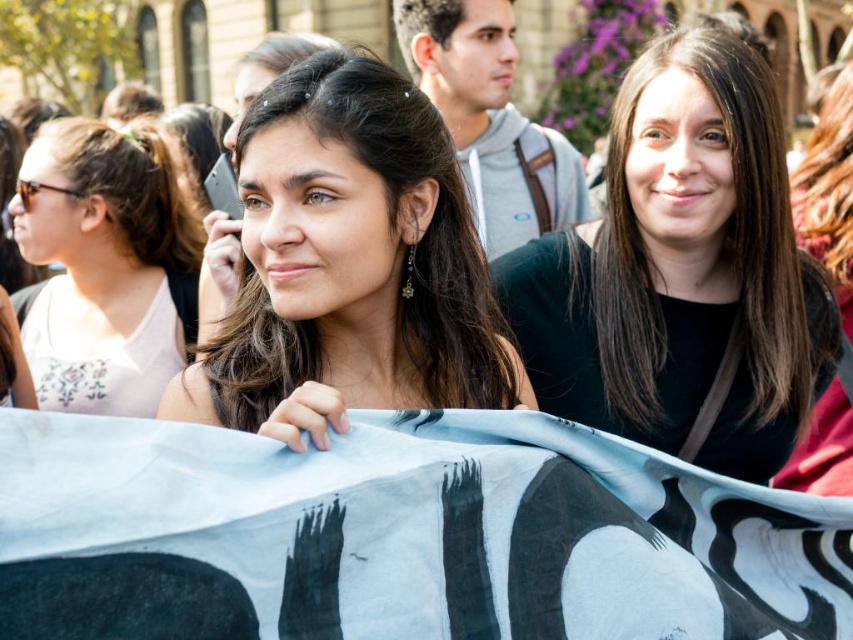
You are a photographer trying to capture a candid shot of the black matte shirt at center and the matte black phone at center in the lively outdoor scene. Since you want both subjects to be clearly visible in the photo, which object should you focus on first to ensure it appears sharp and in focus?

The black matte shirt at center is smaller than the matte black phone at center, so you should focus on the matte black phone at center first because larger objects require more precise focusing to ensure clarity.

You are standing in the crowd at the event and want to take a photo of the point at coordinates [654,248]. If your camera has a maximum focus range of 50 meters, will you be able to capture the point clearly?

The distance of point [654,248] from the viewer is 48.92 meters, which is within the camera maximum focus range of 50 meters. Therefore, you can capture the point clearly.

You are at an outdoor event and want to take a photo of the matte black phone at center and the white fabric at left. Since you want to include both in the frame, which object should you position closer to the camera to ensure they appear the same size in your photo?

The matte black phone at center is wider than the white fabric at left. To make them appear the same size in the photo, position the wider matte black phone at center farther from the camera and the narrower white fabric at left closer to the camera. This way, their sizes in the frame will balance out.